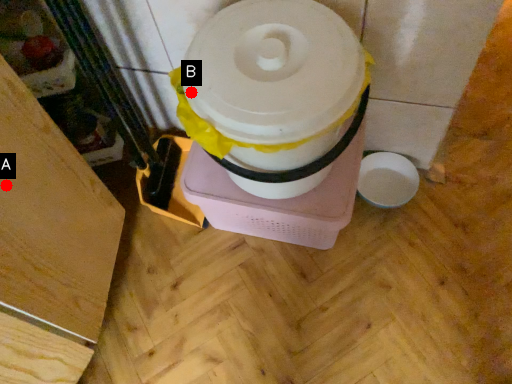
Question: Two points are circled on the image, labeled by A and B beside each circle. Which point is closer to the camera?

Choices:
 (A) A is closer
 (B) B is closer

Answer: (A)